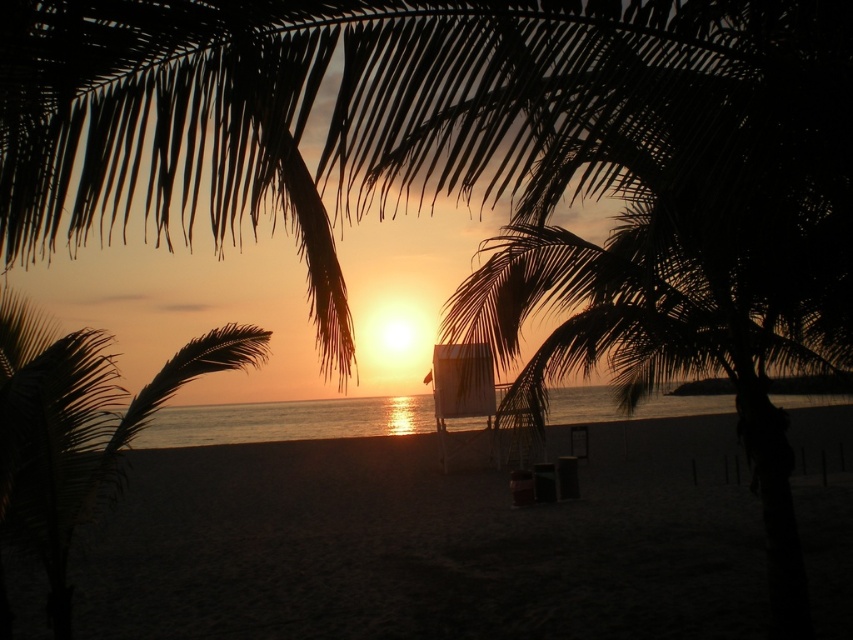
Question: Which point is farther from the camera taking this photo?

Choices:
 (A) (265, 499)
 (B) (78, 522)

Answer: (A)

Question: Among these objects, which one is nearest to the camera?

Choices:
 (A) dark sand at center
 (B) dark brown leafy palm tree at lower left

Answer: (B)

Question: Which object is closer to the camera taking this photo?

Choices:
 (A) dark sand at center
 (B) dark brown leafy palm tree at lower left

Answer: (B)

Question: Does dark sand at center appear over dark brown leafy palm tree at lower left?

Choices:
 (A) yes
 (B) no

Answer: (B)

Question: Is dark sand at center bigger than dark brown leafy palm tree at lower left?

Choices:
 (A) no
 (B) yes

Answer: (B)

Question: Is dark sand at center to the right of dark brown leafy palm tree at lower left from the viewer's perspective?

Choices:
 (A) no
 (B) yes

Answer: (B)